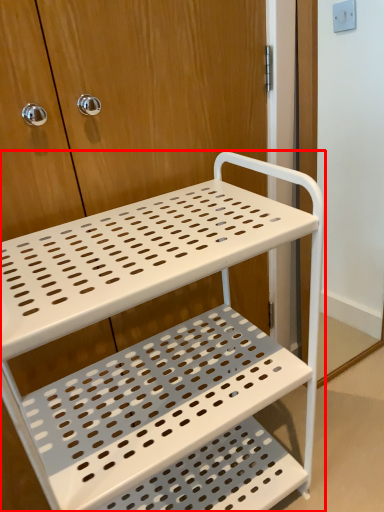
Question: In this image, where is furniture (annotated by the red box) located relative to screen door?

Choices:
 (A) right
 (B) left

Answer: (B)